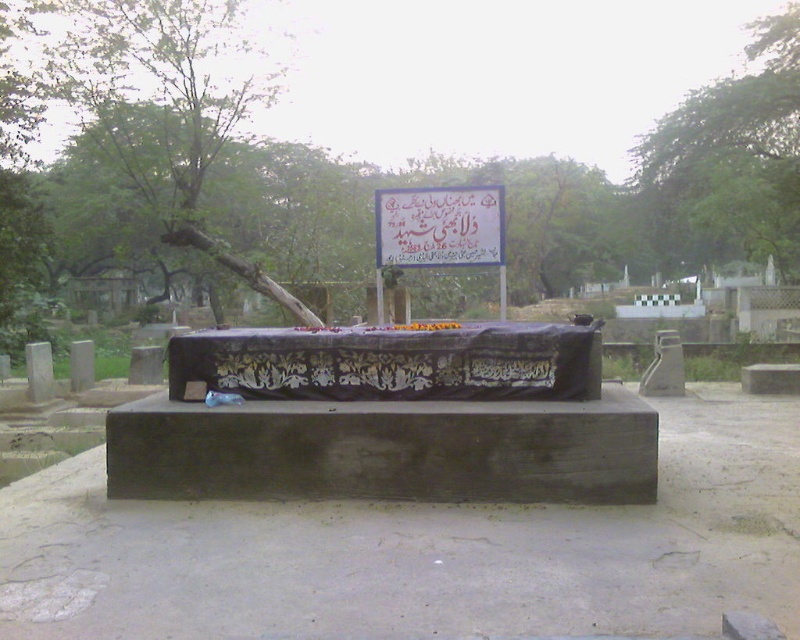
You are standing in the cemetery and see the green leafy tree at left and the green leafy tree at upper right. Which tree is located more to the left?

The green leafy tree at left is positioned on the left side of green leafy tree at upper right, so it is more to the left.

You are standing in the cemetery and want to read the text on the white paper sign at center. However, there is a green leafy tree at center blocking your view. Can you see the sign clearly?

The green leafy tree at center is positioned over white paper sign at center, so the tree is blocking the view of the sign. You cannot see the sign clearly.